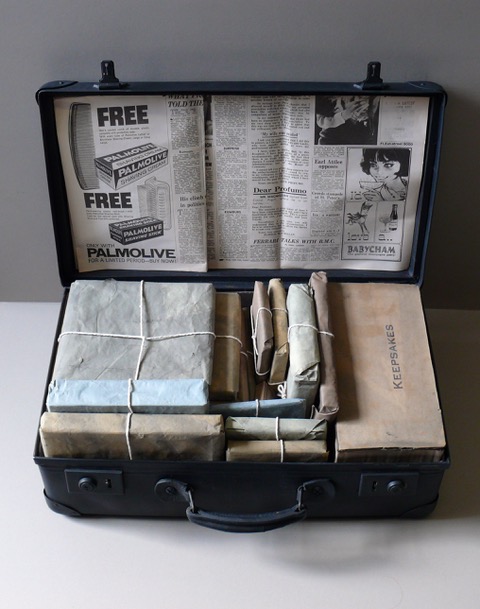
Locate an element on the screen. box is located at coordinates (267, 420).